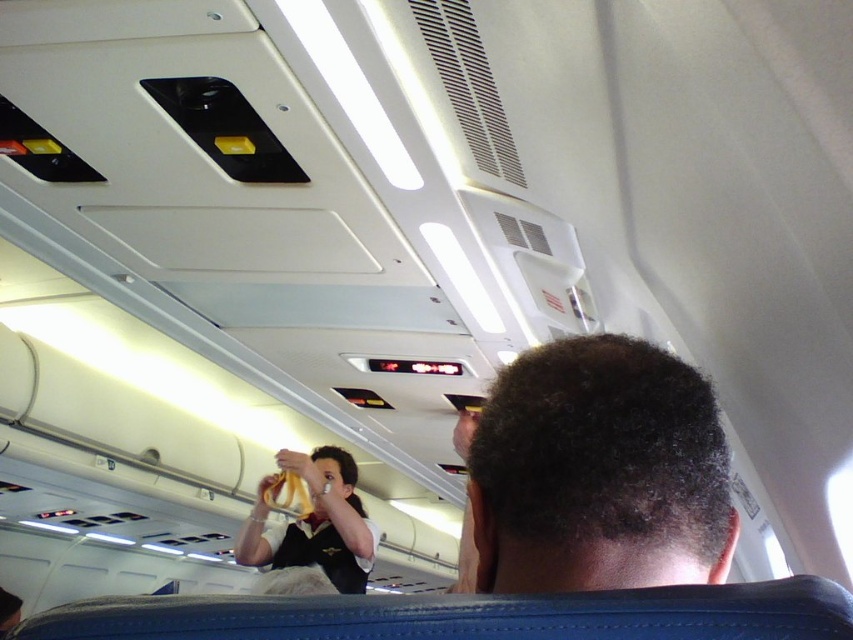
Question: Which point is farther to the camera?

Choices:
 (A) dark curly hair at center
 (B) white uniform at center

Answer: (B)

Question: Can you confirm if dark curly hair at center is positioned below white uniform at center?

Choices:
 (A) no
 (B) yes

Answer: (A)

Question: Among these points, which one is farthest from the camera?

Choices:
 (A) (675, 525)
 (B) (355, 588)

Answer: (B)

Question: Which point is closer to the camera?

Choices:
 (A) (648, 528)
 (B) (315, 516)

Answer: (A)

Question: Is dark curly hair at center to the right of white uniform at center from the viewer's perspective?

Choices:
 (A) yes
 (B) no

Answer: (A)

Question: In this image, where is dark curly hair at center located relative to white uniform at center?

Choices:
 (A) below
 (B) above

Answer: (B)